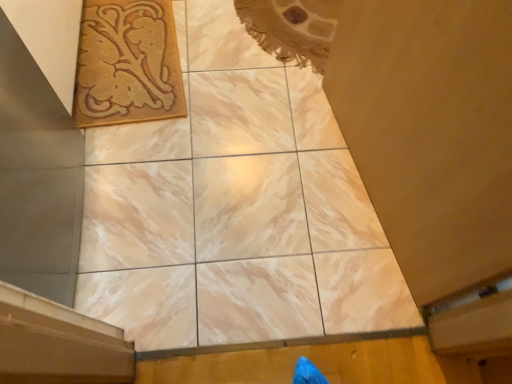
Find the location of a particular element. vacant area on top of beige woven rug at upper left (from a real-world perspective) is located at coordinates (123, 58).